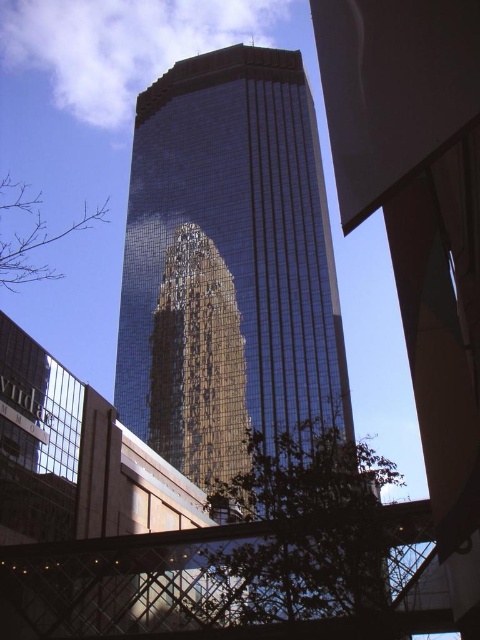
Question: Which of the following is the farthest from the observer?

Choices:
 (A) (345, 529)
 (B) (36, 246)

Answer: (B)

Question: Does shiny glass tower at center have a larger size compared to green leafy tree at lower center?

Choices:
 (A) yes
 (B) no

Answer: (A)

Question: Can you confirm if green leafy tree at lower center is positioned below bare branches at lower left?

Choices:
 (A) yes
 (B) no

Answer: (A)

Question: Is shiny glass tower at center to the right of green leafy tree at lower center from the viewer's perspective?

Choices:
 (A) no
 (B) yes

Answer: (A)

Question: Which object appears farthest from the camera in this image?

Choices:
 (A) bare branches at lower left
 (B) shiny glass tower at center
 (C) green leafy tree at lower center

Answer: (A)

Question: Considering the real-world distances, which object is farthest from the green leafy tree at lower center?

Choices:
 (A) shiny glass tower at center
 (B) bare branches at lower left

Answer: (B)